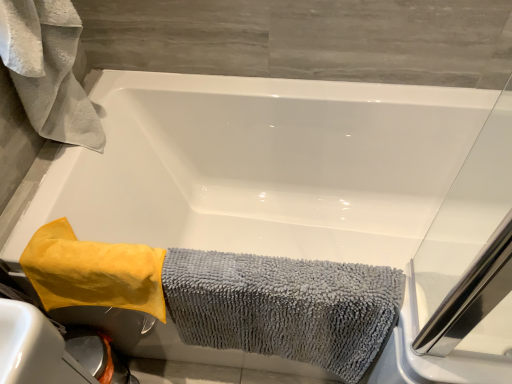
Question: Looking at their shapes, would you say white fluffy towel at upper left, which appears as the 1th bath towel when viewed from the left, is wider or thinner than yellow microfiber towel at lower left, which ranks as the second bath towel in right-to-left order?

Choices:
 (A) wide
 (B) thin

Answer: (A)

Question: From the image's perspective, is white fluffy towel at upper left, which appears as the 1th bath towel when viewed from the left, located above or below yellow microfiber towel at lower left, which ranks as the second bath towel in right-to-left order?

Choices:
 (A) above
 (B) below

Answer: (A)

Question: Which object is the farthest from the yellow microfiber towel at lower left, which ranks as the second bath towel in right-to-left order?

Choices:
 (A) gray microfiber towel at lower left, which is the third bath towel from left to right
 (B) white fluffy towel at upper left, which is the 3th bath towel in right-to-left order

Answer: (B)

Question: Estimate the real-world distances between objects in this image. Which object is farther from the white fluffy towel at upper left, which appears as the 1th bath towel when viewed from the left?

Choices:
 (A) gray microfiber towel at lower left, positioned as the 1th bath towel in right-to-left order
 (B) yellow microfiber towel at lower left, the second bath towel viewed from the left

Answer: (A)